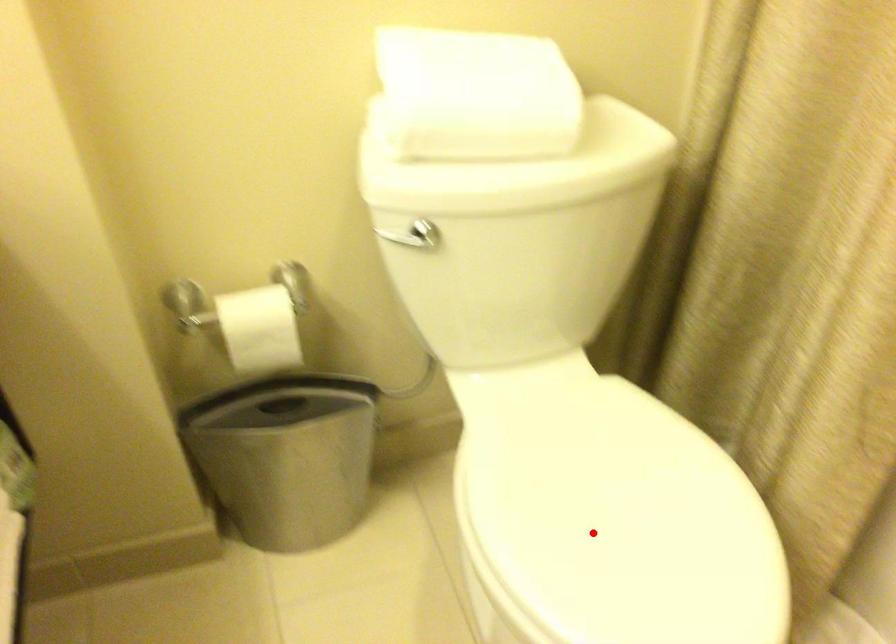
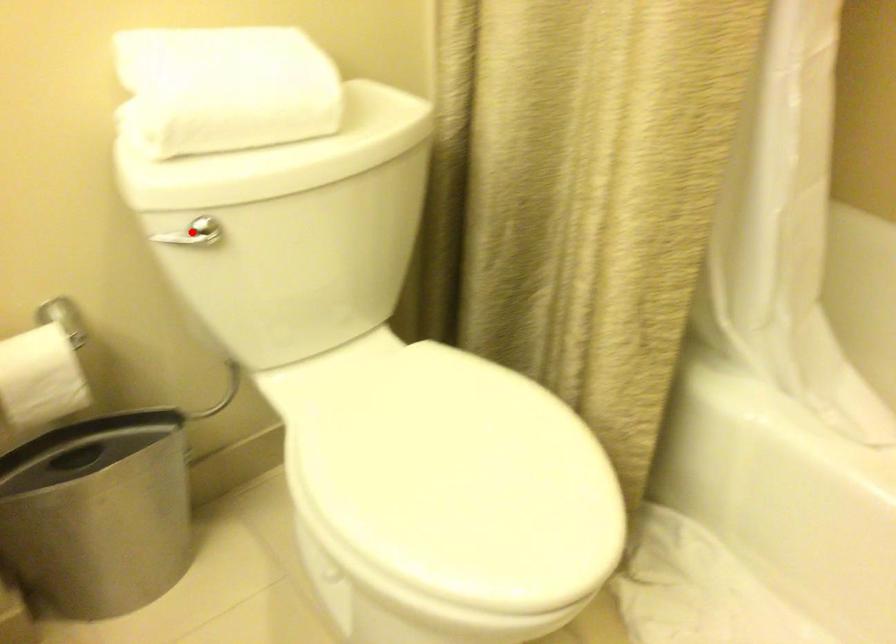
I am providing you with two images of the same scene from different viewpoints. A red point is marked on the first image and another point is marked on the second image. Do the highlighted points in image1 and image2 indicate the same real-world spot?

No